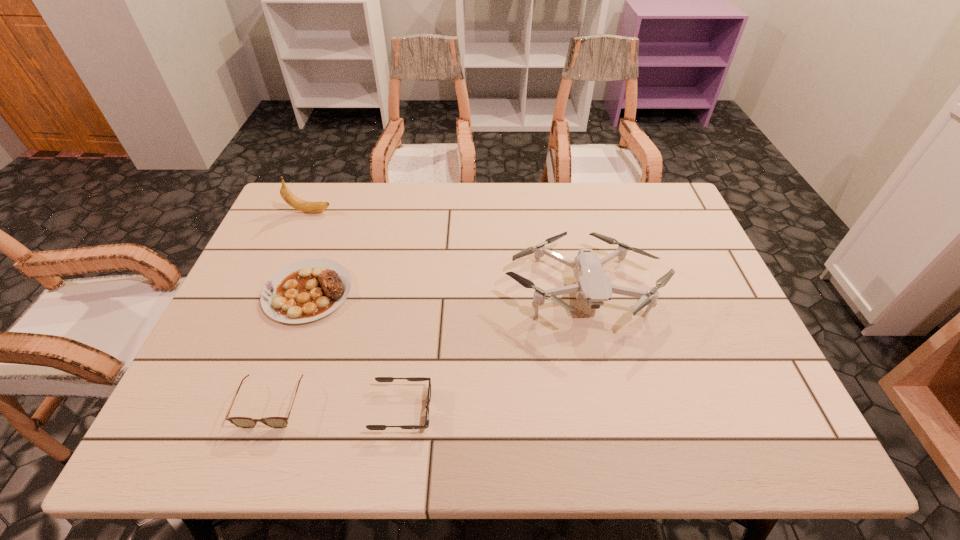
At what (x,y) coordinates should I click in order to perform the action: click on object located in the near left corner section of the desktop. Please return your answer as a coordinate pair (x, y). The width and height of the screenshot is (960, 540). Looking at the image, I should click on (243, 422).

You are a GUI agent. You are given a task and a screenshot of the screen. Output one action in this format:
    pyautogui.click(x=<x>, y=<y>)
    Task: Click on the vacant region at the far edge of the desktop
    This screenshot has width=960, height=540.
    Given the screenshot: What is the action you would take?
    pyautogui.click(x=394, y=207)

Image resolution: width=960 pixels, height=540 pixels. Find the location of `free space at the near edge`. free space at the near edge is located at coordinates (581, 450).

You are a GUI agent. You are given a task and a screenshot of the screen. Output one action in this format:
    pyautogui.click(x=<x>, y=<y>)
    Task: Click on the free space at the left edge of the desktop
    The width and height of the screenshot is (960, 540).
    Given the screenshot: What is the action you would take?
    pyautogui.click(x=236, y=334)

Where is `blank space at the right edge of the desktop`? This screenshot has width=960, height=540. blank space at the right edge of the desktop is located at coordinates (654, 253).

Identify the location of vacant space at the far right corner. This screenshot has height=540, width=960. (657, 228).

The height and width of the screenshot is (540, 960). Find the location of `unoccupied position between the farthest object and the second tallest object`. unoccupied position between the farthest object and the second tallest object is located at coordinates (446, 250).

You are a GUI agent. You are given a task and a screenshot of the screen. Output one action in this format:
    pyautogui.click(x=<x>, y=<y>)
    Task: Click on the vacant area that lies between the drone and the spectacles
    The image size is (960, 540).
    Given the screenshot: What is the action you would take?
    pyautogui.click(x=427, y=347)

This screenshot has height=540, width=960. In order to click on vacant region between the tallest object and the steak in this screenshot , I will do `click(309, 252)`.

This screenshot has width=960, height=540. Find the location of `vacant space that is in between the fourth object from left to right and the rightmost object`. vacant space that is in between the fourth object from left to right and the rightmost object is located at coordinates (492, 349).